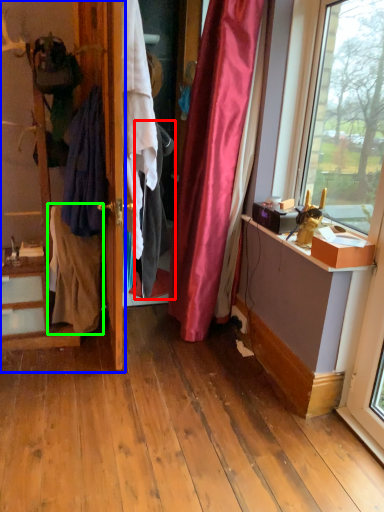
Question: Based on their relative distances, which object is farther from clothing (highlighted by a red box)? Choose from dresser (highlighted by a blue box) and clothing (highlighted by a green box).

Choices:
 (A) dresser
 (B) clothing

Answer: (A)